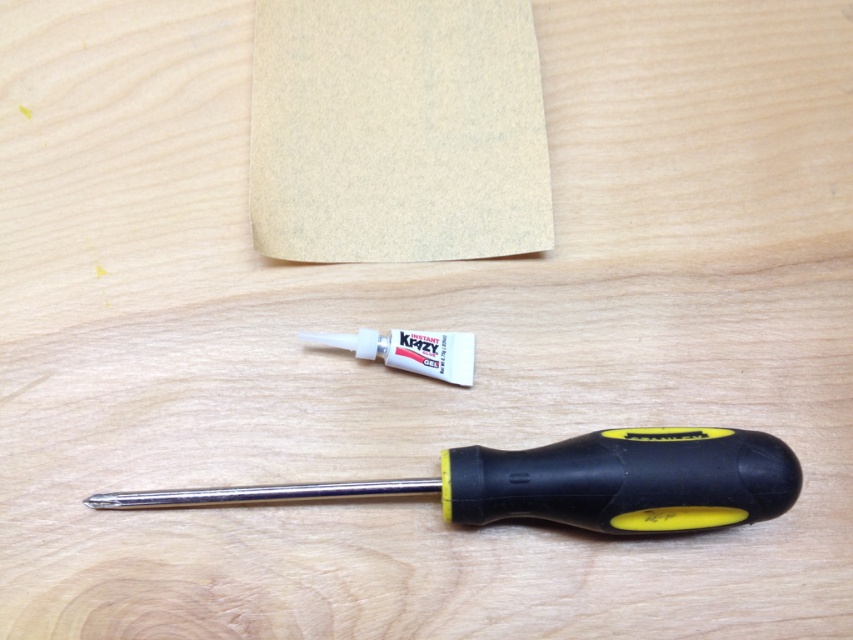
Describe the element at coordinates (396, 131) in the screenshot. I see `beige felt paper at upper center` at that location.

Which is in front, point (303, 157) or point (450, 477)?

Point (450, 477) is in front.

What do you see at coordinates (396, 131) in the screenshot? I see `beige felt paper at upper center` at bounding box center [396, 131].

Where is `beige felt paper at upper center`? The width and height of the screenshot is (853, 640). beige felt paper at upper center is located at coordinates (396, 131).